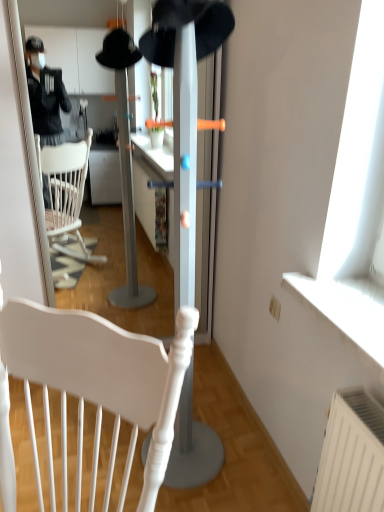
Question: From a real-world perspective, does black felt hat at center stand above white matte chair at center?

Choices:
 (A) yes
 (B) no

Answer: (A)

Question: Is black felt hat at center behind white matte chair at center?

Choices:
 (A) yes
 (B) no

Answer: (B)

Question: Is black felt hat at center positioned far away from white matte chair at center?

Choices:
 (A) no
 (B) yes

Answer: (A)

Question: Considering the relative sizes of black felt hat at center and white matte chair at center in the image provided, is black felt hat at center wider than white matte chair at center?

Choices:
 (A) yes
 (B) no

Answer: (B)

Question: Can you confirm if black felt hat at center is positioned to the left of white matte chair at center?

Choices:
 (A) yes
 (B) no

Answer: (B)

Question: Is black felt hat at center oriented towards white matte chair at center?

Choices:
 (A) yes
 (B) no

Answer: (B)

Question: Can you confirm if white matte chair at center is shorter than black felt hat at center?

Choices:
 (A) no
 (B) yes

Answer: (B)

Question: Is white matte chair at center next to black felt hat at center and touching it?

Choices:
 (A) yes
 (B) no

Answer: (B)

Question: From the image's perspective, is white matte chair at center below black felt hat at center?

Choices:
 (A) no
 (B) yes

Answer: (B)

Question: Is white matte chair at center smaller than black felt hat at center?

Choices:
 (A) no
 (B) yes

Answer: (A)

Question: Can you confirm if white matte chair at center is thinner than black felt hat at center?

Choices:
 (A) no
 (B) yes

Answer: (A)

Question: Is white matte chair at center surrounding black felt hat at center?

Choices:
 (A) no
 (B) yes

Answer: (A)

Question: From the image's perspective, is black felt hat at center located above or below white matte chair at center?

Choices:
 (A) below
 (B) above

Answer: (B)